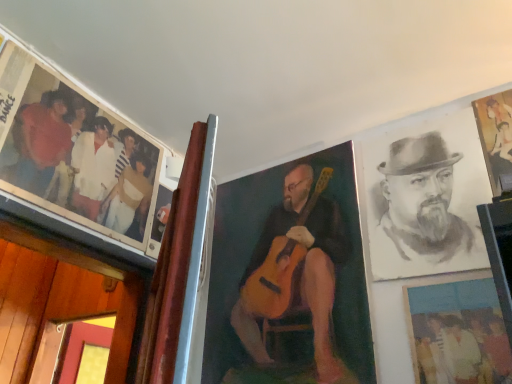
Question: Considering the relative sizes of wooden frame at center, which is counted as the 3th picture frame, starting from the right, and matte plastic photo at lower right, which is counted as the 2th picture frame, starting from the right, in the image provided, is wooden frame at center, which is counted as the 3th picture frame, starting from the right, shorter than matte plastic photo at lower right, which is counted as the 2th picture frame, starting from the right,?

Choices:
 (A) no
 (B) yes

Answer: (A)

Question: From the image's perspective, is wooden frame at center, which is counted as the 3th picture frame, starting from the right, above matte plastic photo at lower right, which is counted as the 2th picture frame, starting from the right?

Choices:
 (A) no
 (B) yes

Answer: (B)

Question: Could you tell me if wooden frame at center, which is counted as the 3th picture frame, starting from the right, is facing matte plastic photo at lower right, acting as the second picture frame starting from the left?

Choices:
 (A) yes
 (B) no

Answer: (B)

Question: Does wooden frame at center, which is counted as the 3th picture frame, starting from the right, have a greater width compared to matte plastic photo at lower right, which is counted as the 2th picture frame, starting from the right?

Choices:
 (A) no
 (B) yes

Answer: (A)

Question: Is wooden frame at center, which is counted as the 3th picture frame, starting from the right, located outside matte plastic photo at lower right, which is counted as the 2th picture frame, starting from the right?

Choices:
 (A) yes
 (B) no

Answer: (A)

Question: Considering the positions of charcoal portrait of man at right and matte plastic photo at lower right, acting as the second picture frame starting from the left, in the image, is charcoal portrait of man at right bigger or smaller than matte plastic photo at lower right, acting as the second picture frame starting from the left,?

Choices:
 (A) small
 (B) big

Answer: (B)

Question: From their relative heights in the image, would you say charcoal portrait of man at right is taller or shorter than matte plastic photo at lower right, which is counted as the 2th picture frame, starting from the right?

Choices:
 (A) short
 (B) tall

Answer: (B)

Question: Considering the positions of point (448, 173) and point (429, 289), is point (448, 173) closer or farther from the camera than point (429, 289)?

Choices:
 (A) farther
 (B) closer

Answer: (A)

Question: Considering their positions, is charcoal portrait of man at right located in front of or behind matte plastic photo at lower right, acting as the second picture frame starting from the left?

Choices:
 (A) front
 (B) behind

Answer: (B)

Question: From the image's perspective, is charcoal portrait of man at right located above or below wooden frame at center, the first picture frame in the left-to-right sequence?

Choices:
 (A) below
 (B) above

Answer: (B)

Question: In terms of size, does charcoal portrait of man at right appear bigger or smaller than wooden frame at center, which is counted as the 3th picture frame, starting from the right?

Choices:
 (A) small
 (B) big

Answer: (B)

Question: Visually, is charcoal portrait of man at right positioned to the left or to the right of wooden frame at center, which is counted as the 3th picture frame, starting from the right?

Choices:
 (A) right
 (B) left

Answer: (A)

Question: Is charcoal portrait of man at right taller or shorter than wooden frame at center, which is counted as the 3th picture frame, starting from the right?

Choices:
 (A) tall
 (B) short

Answer: (B)

Question: Relative to gold metallic painting at upper right, which is the third picture frame from left to right, is matte black photo at upper left in front or behind?

Choices:
 (A) front
 (B) behind

Answer: (A)

Question: From the image's perspective, relative to gold metallic painting at upper right, positioned as the 1th picture frame in right-to-left order, is matte black photo at upper left above or below?

Choices:
 (A) below
 (B) above

Answer: (A)